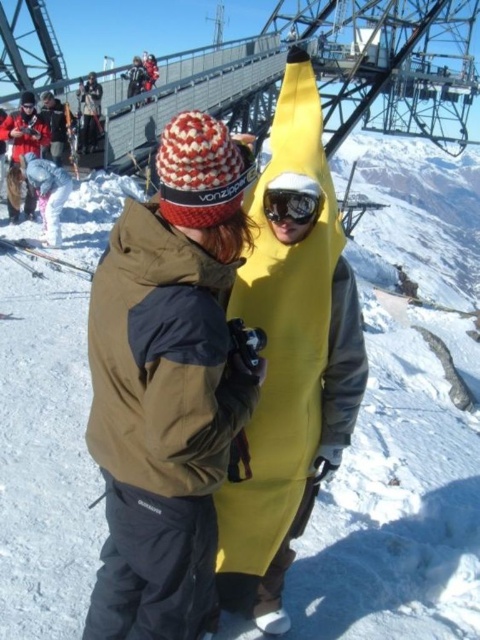
Does yellow matte/glossy goggles at center have a greater height compared to metallic silver ski at center?

No.

Can you confirm if yellow matte/glossy goggles at center is smaller than metallic silver ski at center?

Yes, yellow matte/glossy goggles at center is smaller than metallic silver ski at center.

Is point (279, 186) closer to camera compared to point (3, 240)?

Yes, point (279, 186) is closer to viewer.

This screenshot has height=640, width=480. In order to click on yellow matte/glossy goggles at center in this screenshot , I will do click(x=292, y=204).

Which of these two, metallic silver ski at center or matte black ski at upper left, stands shorter?

metallic silver ski at center is shorter.

Is metallic silver ski at center wider than matte black ski at upper left?

Indeed, metallic silver ski at center has a greater width compared to matte black ski at upper left.

What do you see at coordinates (41, 253) in the screenshot? I see `metallic silver ski at center` at bounding box center [41, 253].

I want to click on metallic silver ski at center, so click(x=41, y=253).

Does yellow matte banana at center appear under matte black ski at upper left?

Indeed, yellow matte banana at center is positioned under matte black ski at upper left.

Does point (312, 131) lie in front of point (69, 148)?

That is True.

Between point (227, 548) and point (75, 161), which one is positioned behind?

The point (75, 161) is more distant.

Identify the location of yellow matte banana at center. (290, 364).